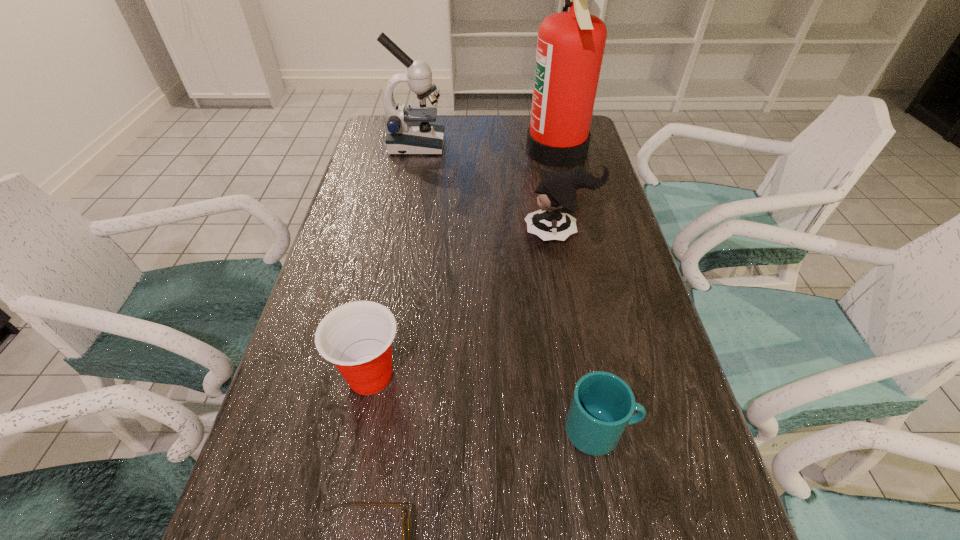
Find the location of a particular element. free space located 0.110m at the nozzle of the fire extinguisher is located at coordinates (492, 151).

Identify the location of vacant area located at the eyepiece of the microscope. (559, 145).

Locate an element on the screen. This screenshot has width=960, height=540. free space located 0.340m at the face of the doll is located at coordinates (394, 233).

Find the location of a particular element. The width and height of the screenshot is (960, 540). free location located 0.260m at the face of the doll is located at coordinates (424, 233).

Locate an element on the screen. vacant space located 0.080m at the face of the doll is located at coordinates (493, 233).

I want to click on vacant space located 0.210m on the back of the left cup, so click(391, 273).

Identify the location of vacant area situated 0.090m on the handle side of the right cup. (687, 430).

Locate an element on the screen. This screenshot has height=540, width=960. fire extinguisher that is at the far edge is located at coordinates (570, 45).

This screenshot has height=540, width=960. What are the coordinates of `microscope at the far edge` in the screenshot? It's located at (409, 132).

Identify the location of microscope at the left edge. This screenshot has width=960, height=540. (409, 132).